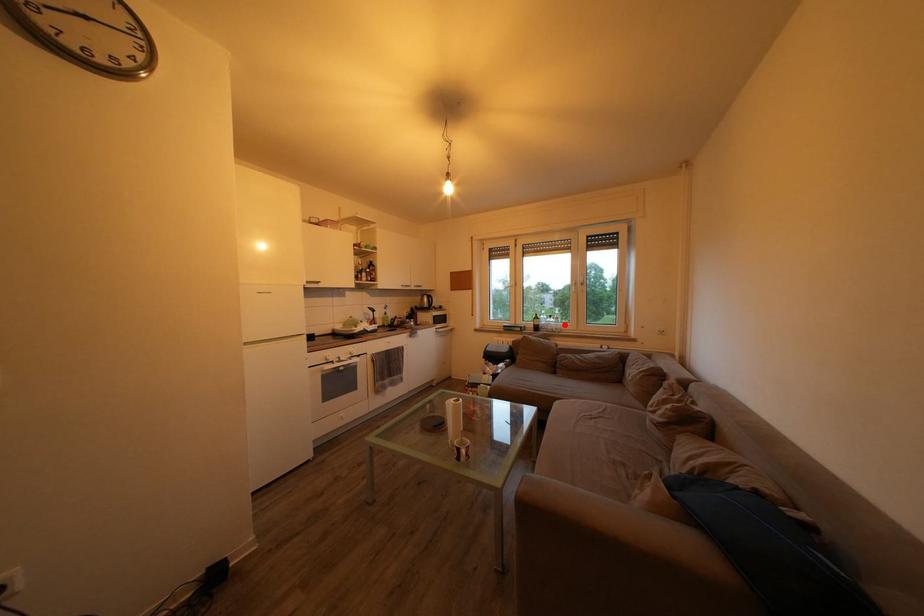
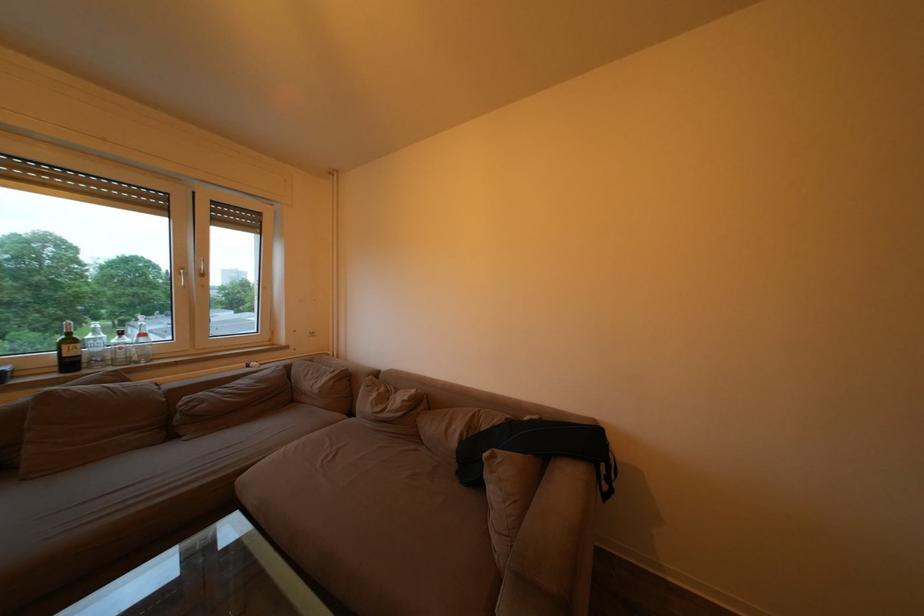
Find the pixel in the second image that matches the highlighted location in the first image.

(151, 341)